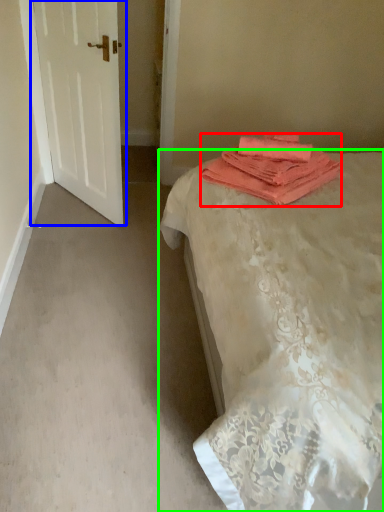
Question: Considering the real-world distances, which object is closest to towel (highlighted by a red box)? door (highlighted by a blue box) or bed (highlighted by a green box).

Choices:
 (A) door
 (B) bed

Answer: (B)